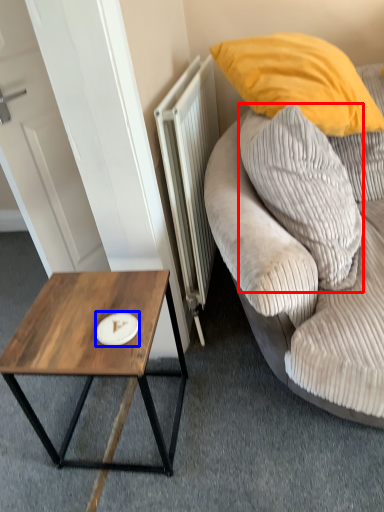
Question: Which object is further to the camera taking this photo, pillow (highlighted by a red box) or plate (highlighted by a blue box)?

Choices:
 (A) pillow
 (B) plate

Answer: (B)